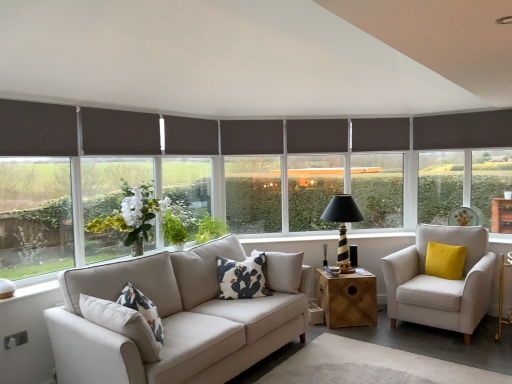
Question: Should I look upward or downward to see dark gray roller blind at center, the 2th window screen when ordered from left to right?

Choices:
 (A) up
 (B) down

Answer: (A)

Question: Can you confirm if light beige fabric armchair at right is thinner than wooden cube at center?

Choices:
 (A) no
 (B) yes

Answer: (A)

Question: Is light beige fabric armchair at right aimed at wooden cube at center?

Choices:
 (A) yes
 (B) no

Answer: (B)

Question: Is light beige fabric armchair at right at the left side of wooden cube at center?

Choices:
 (A) no
 (B) yes

Answer: (A)

Question: From the image's perspective, is light beige fabric armchair at right under wooden cube at center?

Choices:
 (A) yes
 (B) no

Answer: (B)

Question: From a real-world perspective, is light beige fabric armchair at right positioned over wooden cube at center based on gravity?

Choices:
 (A) yes
 (B) no

Answer: (A)

Question: Does light beige fabric armchair at right lie in front of wooden cube at center?

Choices:
 (A) yes
 (B) no

Answer: (A)

Question: Is light beige fabric armchair at right oriented towards dark brown roller blind at center?

Choices:
 (A) no
 (B) yes

Answer: (A)

Question: Considering the relative positions of light beige fabric armchair at right and dark brown roller blind at center in the image provided, is light beige fabric armchair at right to the left of dark brown roller blind at center from the viewer's perspective?

Choices:
 (A) no
 (B) yes

Answer: (A)

Question: From the image's perspective, is light beige fabric armchair at right beneath dark brown roller blind at center?

Choices:
 (A) yes
 (B) no

Answer: (A)

Question: From a real-world perspective, is light beige fabric armchair at right below dark brown roller blind at center?

Choices:
 (A) yes
 (B) no

Answer: (A)

Question: From a real-world perspective, is light beige fabric armchair at right on top of dark brown roller blind at center?

Choices:
 (A) yes
 (B) no

Answer: (B)

Question: Is light beige fabric armchair at right far away from dark brown roller blind at center?

Choices:
 (A) no
 (B) yes

Answer: (B)

Question: Is the surface of white cotton cushion at center, acting as the first pillow starting from the left, in direct contact with dark gray roller blind at left, the 1th window screen viewed from the front?

Choices:
 (A) yes
 (B) no

Answer: (B)